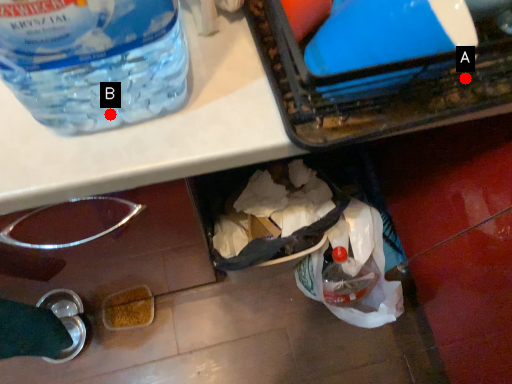
Question: Two points are circled on the image, labeled by A and B beside each circle. Among these points, which one is nearest to the camera?

Choices:
 (A) A is closer
 (B) B is closer

Answer: (A)